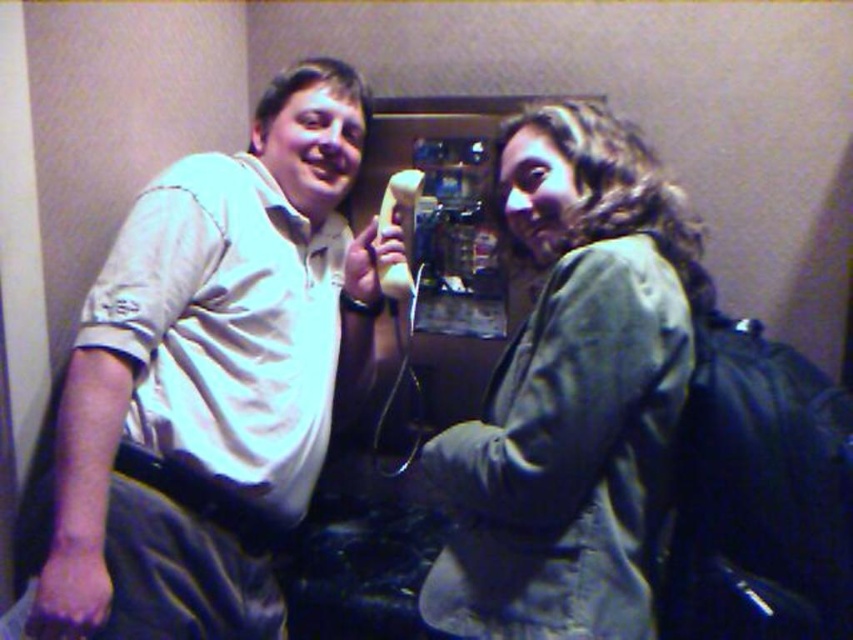
Is matte white shirt at upper left positioned in front of green fabric jacket at upper right?

No, it is not.

Locate an element on the screen. matte white shirt at upper left is located at coordinates (210, 376).